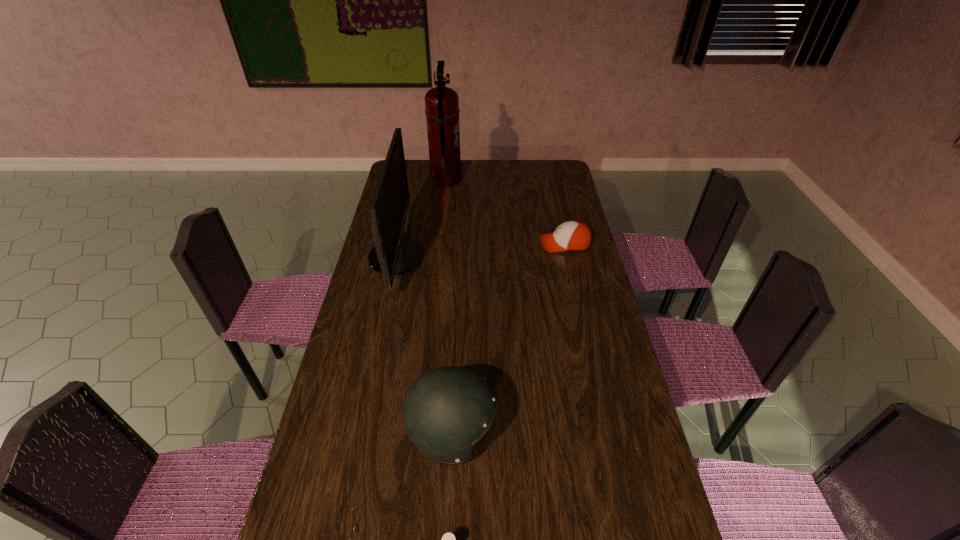
This screenshot has height=540, width=960. I want to click on the tallest object, so click(x=442, y=111).

Where is `the farthest object`? the farthest object is located at coordinates (442, 111).

What are the coordinates of `the second tallest object` in the screenshot? It's located at (392, 255).

Locate an element on the screen. the third shortest object is located at coordinates (447, 410).

Identify the location of football helmet. The width and height of the screenshot is (960, 540). (447, 410).

You are a GUI agent. You are given a task and a screenshot of the screen. Output one action in this format:
    pyautogui.click(x=<x>, y=<y>)
    Task: Click on the second shortest object
    The width and height of the screenshot is (960, 540).
    Given the screenshot: What is the action you would take?
    [575, 236]

This screenshot has height=540, width=960. I want to click on the rightmost object, so click(x=575, y=236).

Where is `vacant region located 0.300m on the nozzle side of the tallest object`? vacant region located 0.300m on the nozzle side of the tallest object is located at coordinates (524, 180).

At what (x,y) coordinates should I click in order to perform the action: click on vacant space located 0.350m on the screen side of the fourth shortest object. Please return your answer as a coordinate pair (x, y). This screenshot has height=540, width=960. Looking at the image, I should click on (515, 258).

Identify the location of vacant space located at the face opening of the third shortest object. (531, 434).